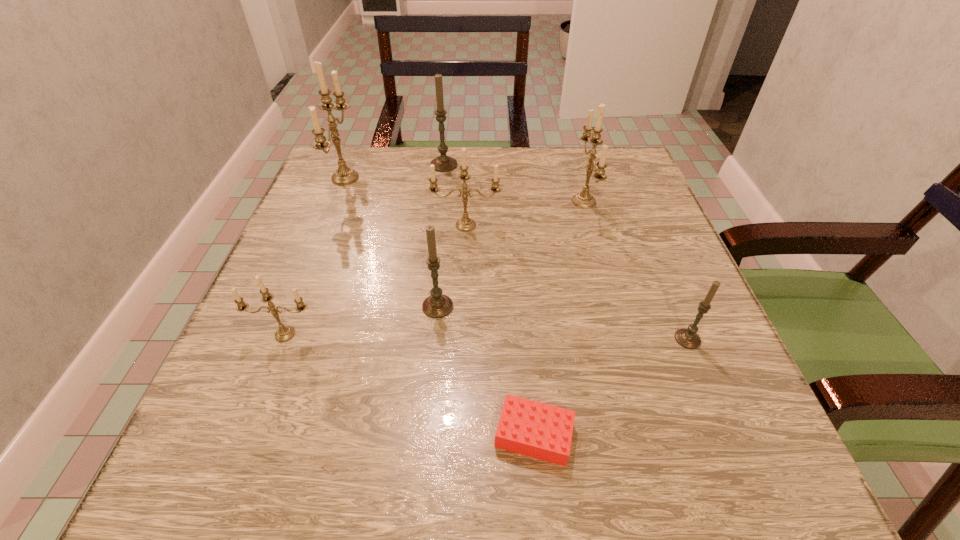
Identify the location of free space at the near right corner. (682, 481).

Where is `empty location between the third smallest metallic candle and the second smallest gray candle`? Image resolution: width=960 pixels, height=540 pixels. empty location between the third smallest metallic candle and the second smallest gray candle is located at coordinates (511, 254).

This screenshot has width=960, height=540. Identify the location of vacant space in between the rightmost gray candle and the second farthest gray candle. (563, 323).

Where is `free area in between the second object from right to left and the farthest gray candle`? This screenshot has height=540, width=960. free area in between the second object from right to left and the farthest gray candle is located at coordinates (514, 183).

This screenshot has height=540, width=960. Find the location of `empty space that is in between the nearest gray candle and the farthest gray candle`. empty space that is in between the nearest gray candle and the farthest gray candle is located at coordinates (565, 252).

Find the location of a particular element. This screenshot has height=540, width=960. unoccupied area between the tallest candle and the fourth nearest object is located at coordinates (392, 242).

I want to click on empty space between the farthest gray candle and the tallest object, so click(395, 171).

Image resolution: width=960 pixels, height=540 pixels. In order to click on blank region between the rightmost object and the second smallest metallic candle in this screenshot , I will do (577, 282).

You are a GUI agent. You are given a task and a screenshot of the screen. Output one action in this format:
    pyautogui.click(x=<x>, y=<y>)
    Task: Click on the free area in between the nearest gray candle and the third biggest metallic candle
    The width and height of the screenshot is (960, 540).
    Given the screenshot: What is the action you would take?
    pyautogui.click(x=577, y=282)

I want to click on free space between the second smallest gray candle and the nearest object, so click(x=486, y=370).